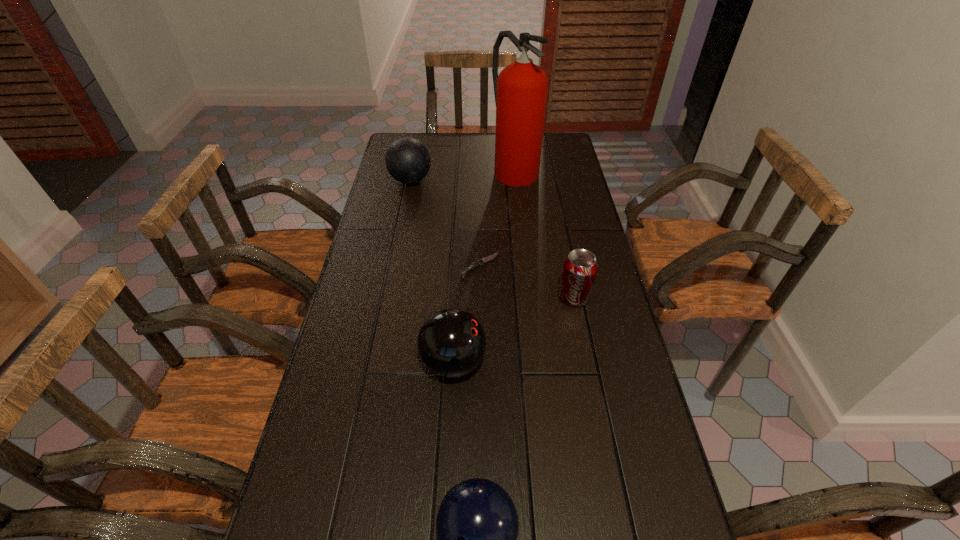
You are a GUI agent. You are given a task and a screenshot of the screen. Output one action in this format:
    pyautogui.click(x=<x>, y=<y>)
    Task: Click on the tallest object
    This screenshot has width=960, height=540.
    Given the screenshot: What is the action you would take?
    pyautogui.click(x=520, y=90)

This screenshot has width=960, height=540. Identify the location of the leftmost bowling ball. (407, 159).

You are a GUI agent. You are given a task and a screenshot of the screen. Output one action in this format:
    pyautogui.click(x=<x>, y=<y>)
    Task: Click on the farthest bowling ball
    This screenshot has height=540, width=960.
    Given the screenshot: What is the action you would take?
    pyautogui.click(x=407, y=159)

This screenshot has height=540, width=960. I want to click on the fifth farthest object, so click(x=451, y=343).

Where is `the third nearest object`? This screenshot has width=960, height=540. the third nearest object is located at coordinates (580, 267).

The height and width of the screenshot is (540, 960). In order to click on the shortest object in this screenshot , I will do `click(481, 262)`.

The image size is (960, 540). Identify the location of the fourth nearest object. (481, 262).

Find the location of a particular element. free space located 0.290m on the handle side of the tallest object is located at coordinates (522, 239).

You are a GUI agent. You are given a task and a screenshot of the screen. Output one action in this format:
    pyautogui.click(x=<x>, y=<y>)
    Task: Click on the vacant region located 0.110m on the grip area of the leftmost object
    The width and height of the screenshot is (960, 540).
    Given the screenshot: What is the action you would take?
    pyautogui.click(x=461, y=180)

The height and width of the screenshot is (540, 960). I want to click on vacant space located on the surface of the second nearest bowling ball near the finger holes, so click(x=630, y=362).